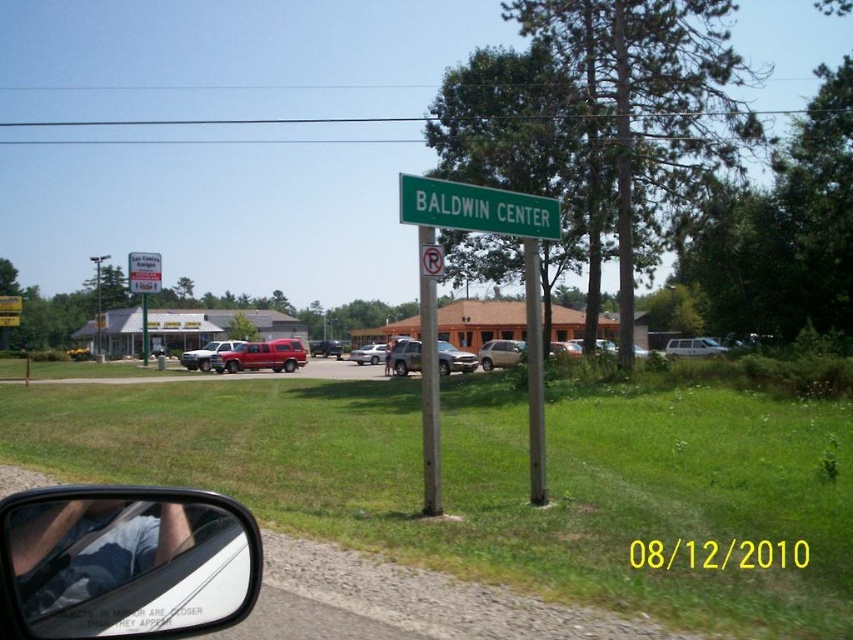
Is point (541, 467) closer to viewer compared to point (144, 292)?

Yes, it is.

Between point (540, 376) and point (160, 260), which one is positioned in front?

Positioned in front is point (540, 376).

Between point (541, 474) and point (136, 280), which one is positioned behind?

The point (136, 280) is more distant.

Where is `green painted wood pole at center`? Image resolution: width=853 pixels, height=640 pixels. green painted wood pole at center is located at coordinates (534, 372).

Does satin silver suv at center have a greater width compared to green plastic sign at center?

Indeed, satin silver suv at center has a greater width compared to green plastic sign at center.

Who is shorter, satin silver suv at center or green plastic sign at center?

green plastic sign at center is shorter.

Between point (479, 353) and point (419, 250), which one is positioned in front?

Positioned in front is point (419, 250).

Identify the location of satin silver suv at center. (500, 353).

Is point (529, 467) positioned behind point (703, 353)?

No, it is not.

Between point (538, 269) and point (699, 349), which one is positioned in front?

Positioned in front is point (538, 269).

Where is `green painted wood pole at center`? The height and width of the screenshot is (640, 853). green painted wood pole at center is located at coordinates (534, 372).